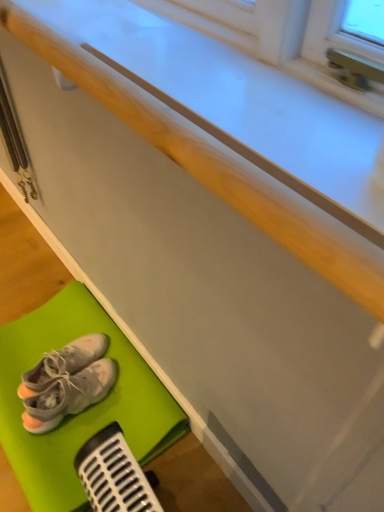
Identify the location of free space that is to the left of white fabric sneakers at lower left, which appears as the second footwear when viewed from the top. (15, 385).